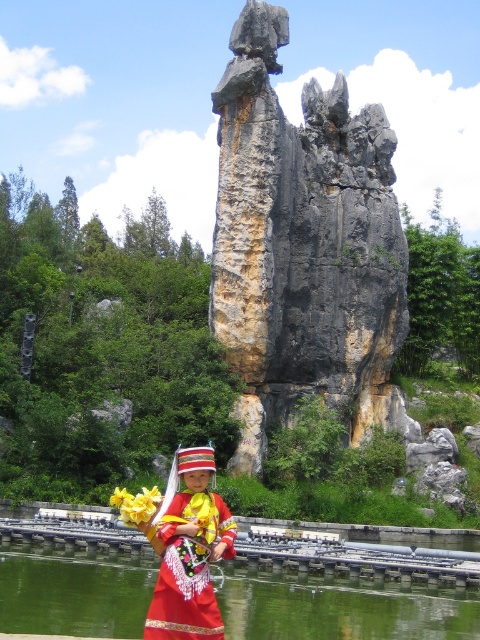
You are a geologist examining the rough gray rock at center. Based on its position in the image, what are the coordinates of the rock?

The rough gray rock at center is located at point (302,244).

You are planning to place a small statue on the rough gray rock at center. Considering the size of the rock, will it be able to support the statue without falling into the green smooth water at lower center?

The rough gray rock at center is narrower than the green smooth water at lower center. Since the rock is narrower, placing a small statue might risk it tipping into the water. Choose a wider rock or a different location for stability.

You are a photographer positioned at the rough gray rock at center and want to take a photo of the yellow fabric flower at lower center. Given that your camera has a maximum focus range of 30 meters, will you be able to capture a clear image of the flower?

The distance between the rough gray rock at center and the yellow fabric flower at lower center is 31.75 meters, which exceeds the camera maximum focus range of 30 meters. Therefore, you won not be able to capture a clear image of the flower.